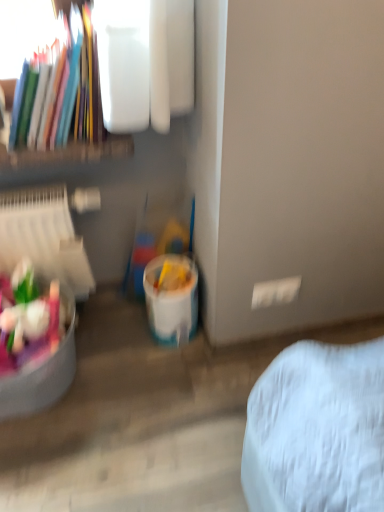
Question: Is matte plastic toys at lower left bigger or smaller than white plastic bucket at lower center?

Choices:
 (A) big
 (B) small

Answer: (A)

Question: From the image's perspective, is matte plastic toys at lower left above or below white plastic bucket at lower center?

Choices:
 (A) above
 (B) below

Answer: (B)

Question: Estimate the real-world distances between objects in this image. Which object is closer to the matte plastic toys at lower left?

Choices:
 (A) matte plastic books at upper left
 (B) white plastic bucket at lower center

Answer: (B)

Question: Which of these objects is positioned closest to the white plastic bucket at lower center?

Choices:
 (A) matte plastic toys at lower left
 (B) matte plastic books at upper left

Answer: (A)